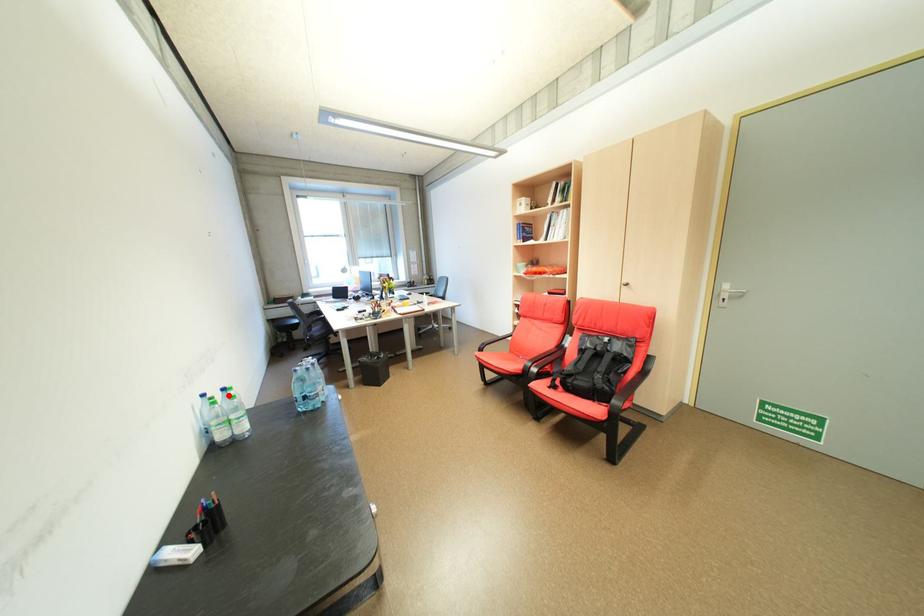
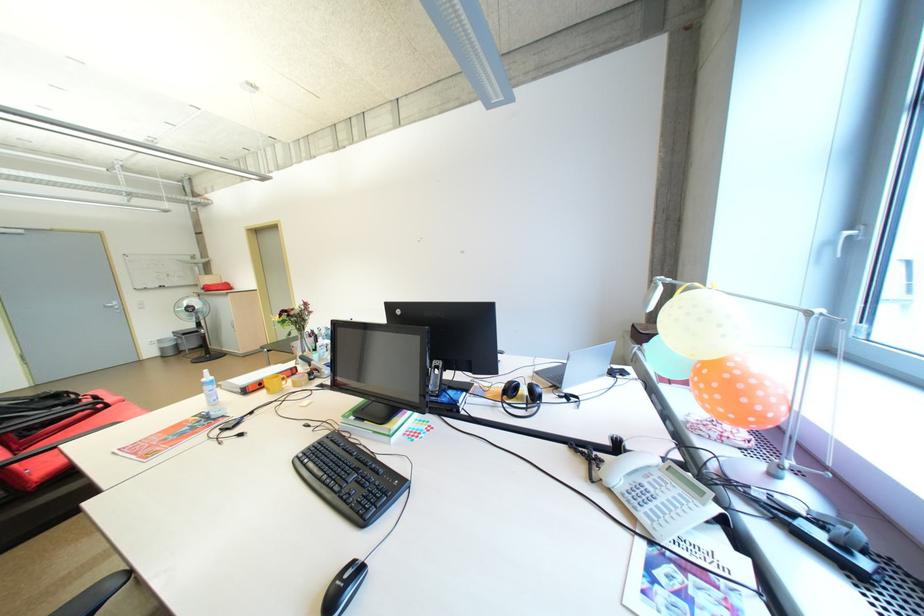
Question: I am providing you with two images of the same scene from different viewpoints. A red point is marked on the first image. Is the red point's position out of view in image 2?

Choices:
 (A) Yes
 (B) No

Answer: (A)